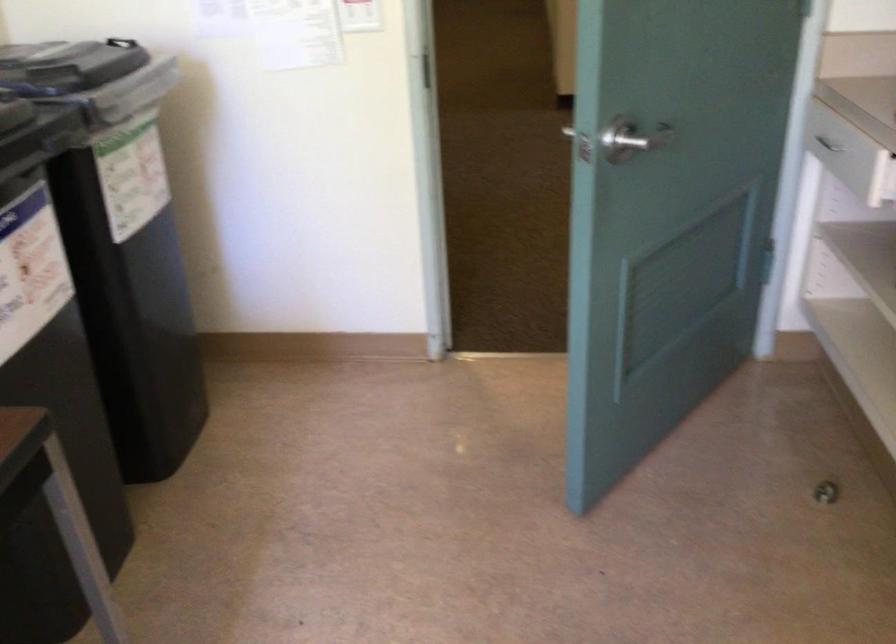
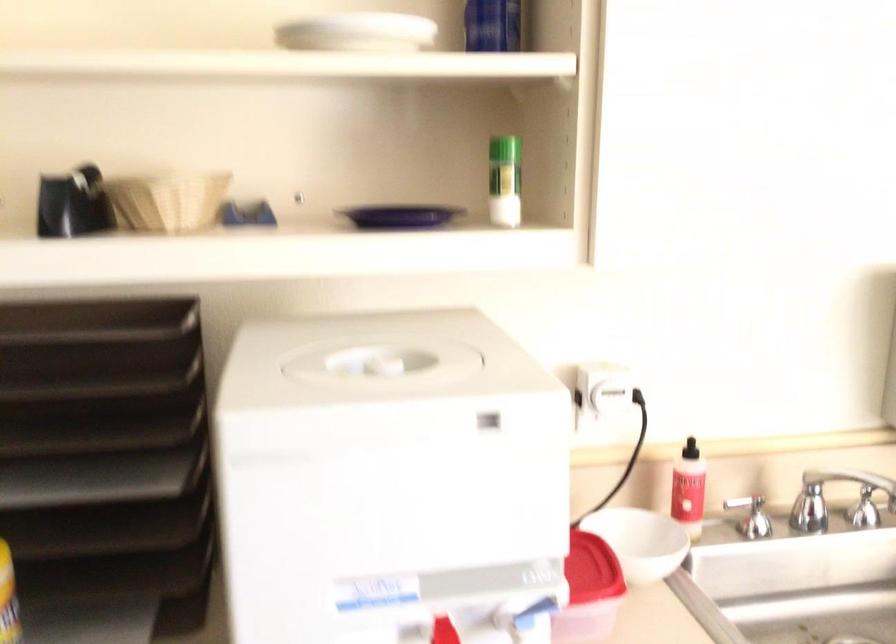
Question: The first image is from the beginning of the video and the second image is from the end. How did the camera likely rotate when shooting the video?

Choices:
 (A) Left
 (B) Right
 (C) Up
 (D) Down

Answer: (B)